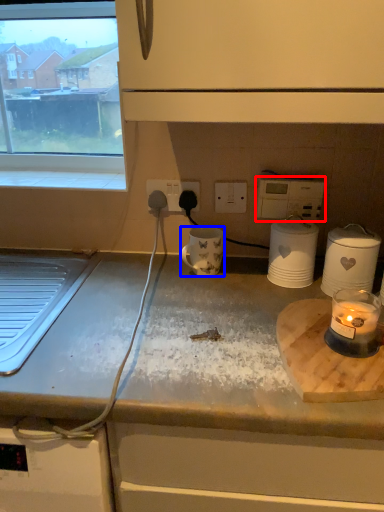
Question: Which object appears farthest to the camera in this image, appliance (highlighted by a red box) or mug (highlighted by a blue box)?

Choices:
 (A) appliance
 (B) mug

Answer: (A)